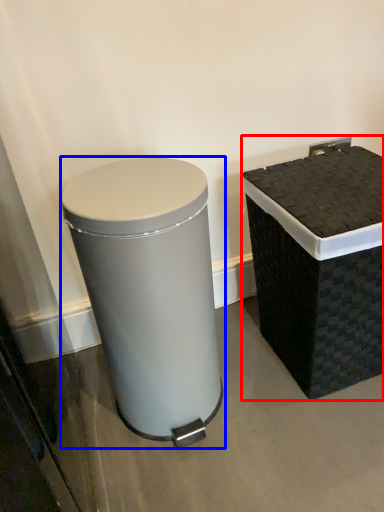
Question: Which point is closer to the camera, waste container (highlighted by a red box) or waste container (highlighted by a blue box)?

Choices:
 (A) waste container
 (B) waste container

Answer: (B)